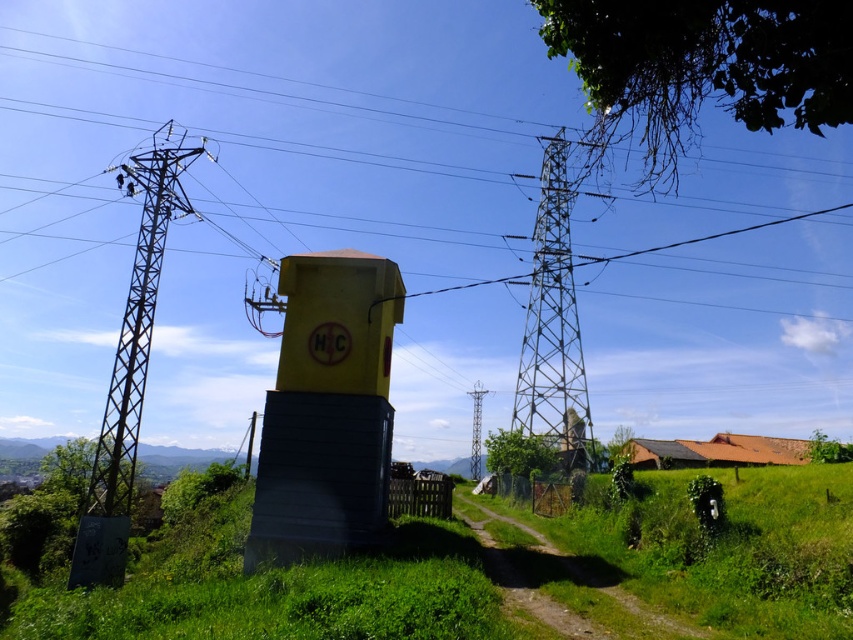
Which of these two, metallic gray tower at left or metallic silver tower at center, stands taller?

Standing taller between the two is metallic silver tower at center.

This screenshot has height=640, width=853. Describe the element at coordinates (137, 316) in the screenshot. I see `metallic gray tower at left` at that location.

Where is `metallic gray tower at left`? This screenshot has height=640, width=853. metallic gray tower at left is located at coordinates (137, 316).

Is metallic gray tower at center to the right of metallic gray tower at left from the viewer's perspective?

Yes, metallic gray tower at center is to the right of metallic gray tower at left.

Is metallic gray tower at center taller than metallic gray tower at left?

Correct, metallic gray tower at center is much taller as metallic gray tower at left.

Which is behind, point (589, 460) or point (184, 163)?

Point (589, 460)

At what (x,y) coordinates should I click in order to perform the action: click on metallic gray tower at center. Please return your answer as a coordinate pair (x, y). The height and width of the screenshot is (640, 853). Looking at the image, I should click on [553, 326].

Which is more to the left, metallic yellow water tower at center or metallic silver tower at center?

Positioned to the left is metallic yellow water tower at center.

Between metallic yellow water tower at center and metallic silver tower at center, which one is positioned lower?

Positioned lower is metallic silver tower at center.

Who is more forward, (509, 131) or (469, 465)?

Point (509, 131) is more forward.

Find the location of `metallic yellow water tower at center`. metallic yellow water tower at center is located at coordinates (259, 90).